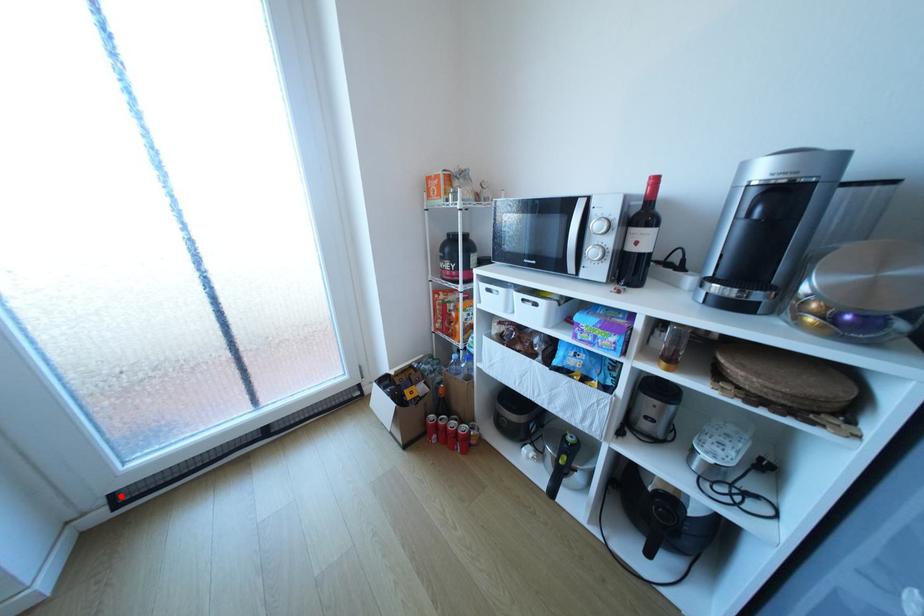
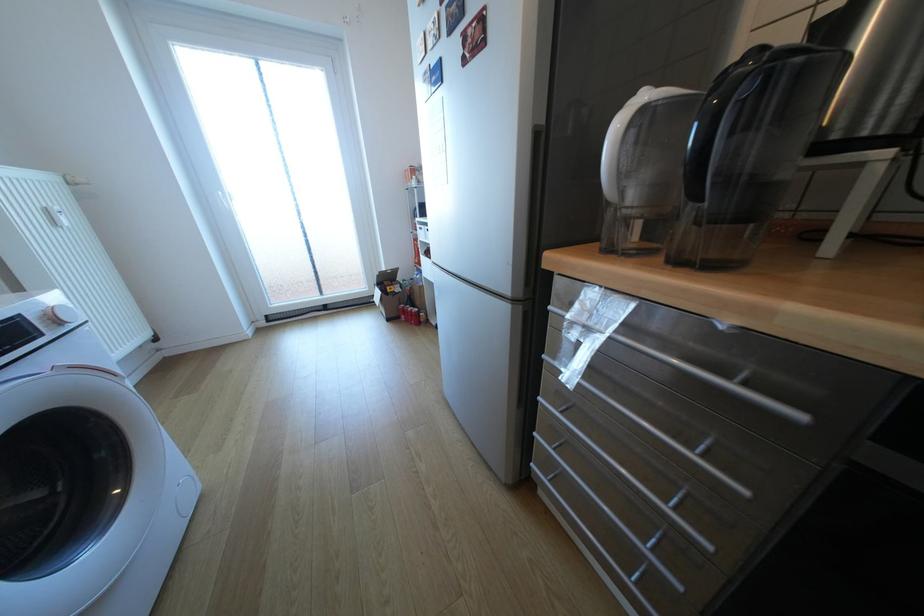
Question: I am providing you with two images of the same scene from different viewpoints. A red point is shown in image1. For the corresponding object point in image2, is it positioned nearer or farther from the camera?

Choices:
 (A) Nearer
 (B) Farther

Answer: (B)